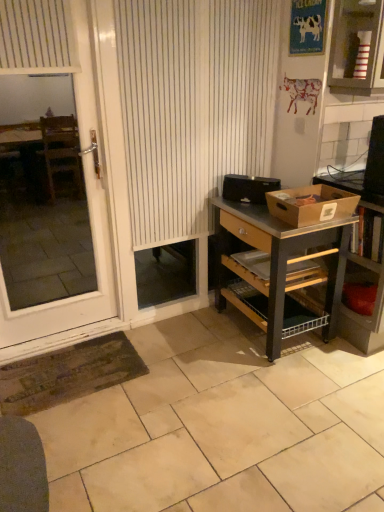
Question: Is black plastic toaster at center, the first box positioned from the back, positioned in front of wooden shelf at right?

Choices:
 (A) yes
 (B) no

Answer: (B)

Question: Can you confirm if black plastic toaster at center, positioned as the second box in front-to-back order, is positioned to the left of wooden shelf at right?

Choices:
 (A) no
 (B) yes

Answer: (B)

Question: From a real-world perspective, is black plastic toaster at center, the first box positioned from the back, beneath wooden shelf at right?

Choices:
 (A) yes
 (B) no

Answer: (B)

Question: Is black plastic toaster at center, the first box positioned from the back, positioned beyond the bounds of wooden shelf at right?

Choices:
 (A) no
 (B) yes

Answer: (B)

Question: Is black plastic toaster at center, the first box positioned from the back, oriented away from wooden shelf at right?

Choices:
 (A) no
 (B) yes

Answer: (A)

Question: Can you confirm if black plastic toaster at center, positioned as the second box in front-to-back order, is positioned to the right of wooden shelf at right?

Choices:
 (A) no
 (B) yes

Answer: (A)

Question: Does wooden shelf at right appear on the right side of striped cardboard box at upper right?

Choices:
 (A) no
 (B) yes

Answer: (B)

Question: Does wooden shelf at right have a greater width compared to striped cardboard box at upper right?

Choices:
 (A) yes
 (B) no

Answer: (A)

Question: From a real-world perspective, is wooden shelf at right physically below striped cardboard box at upper right?

Choices:
 (A) yes
 (B) no

Answer: (A)

Question: Does wooden shelf at right lie in front of striped cardboard box at upper right?

Choices:
 (A) yes
 (B) no

Answer: (B)

Question: Does wooden shelf at right appear on the left side of striped cardboard box at upper right?

Choices:
 (A) yes
 (B) no

Answer: (B)

Question: Considering the relative sizes of wooden shelf at right and striped cardboard box at upper right in the image provided, is wooden shelf at right shorter than striped cardboard box at upper right?

Choices:
 (A) no
 (B) yes

Answer: (A)

Question: Is black plastic toaster at center, positioned as the second box in front-to-back order, beside white glossy screen door at left?

Choices:
 (A) yes
 (B) no

Answer: (B)